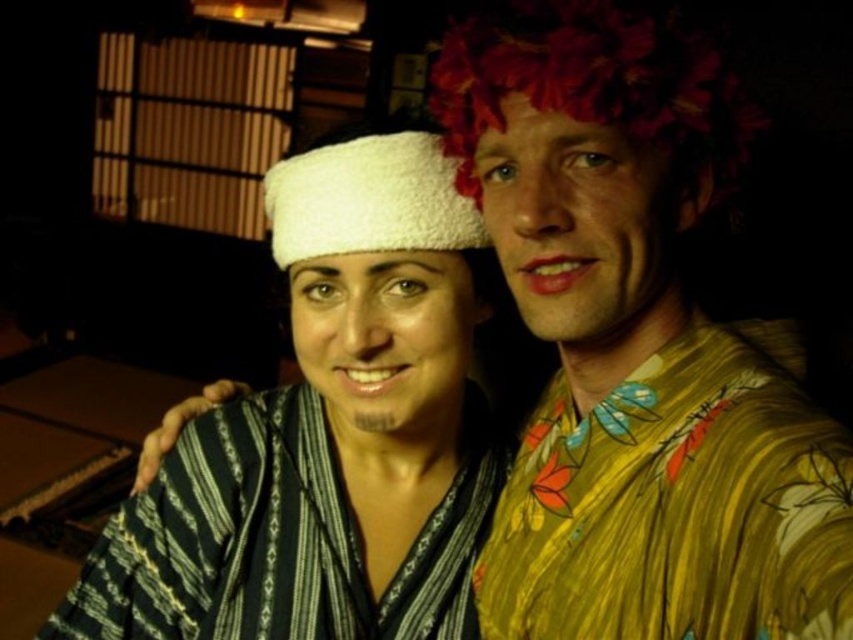
You are an anthropologist studying traditional clothing in this scene. You notice a point at coordinates (636,348). Based on the scene description, can you identify what object this point is located on?

The point at coordinates (636,348) is located on the floral patterned shirt at upper right.

You are a costume designer preparing for a play. You have two items to place on a display stand. The yellow floral robe at right and the white fluffy bandage at center. Which item should you choose if you want to display a larger piece?

The white fluffy bandage at center is larger than the yellow floral robe at right, so you should choose the white fluffy bandage at center to display the larger piece.